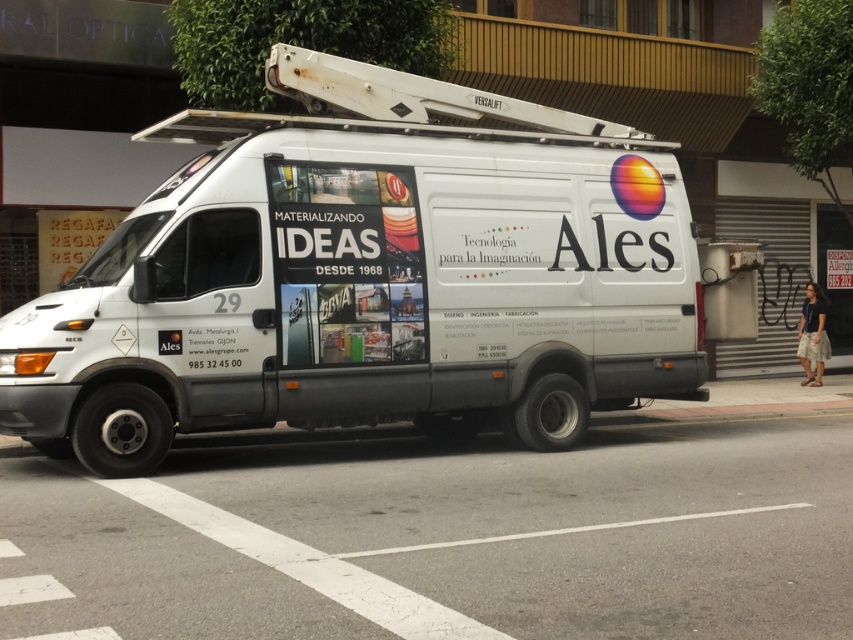
Which is in front, point (293, 136) or point (346, 205)?

Point (293, 136) is more forward.

Does white matte van at center appear on the right side of matte paper poster at center?

In fact, white matte van at center is to the left of matte paper poster at center.

Does point (532, 371) come behind point (387, 305)?

Yes.

Locate an element on the screen. The height and width of the screenshot is (640, 853). white matte van at center is located at coordinates (x=368, y=276).